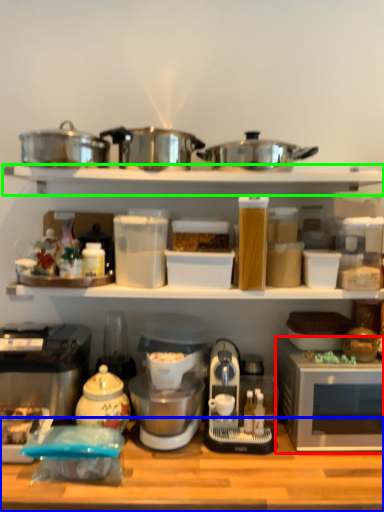
Question: Which object is positioned farthest from microwave oven (highlighted by a red box)? Select from table (highlighted by a blue box) and shelf (highlighted by a green box).

Choices:
 (A) table
 (B) shelf

Answer: (B)